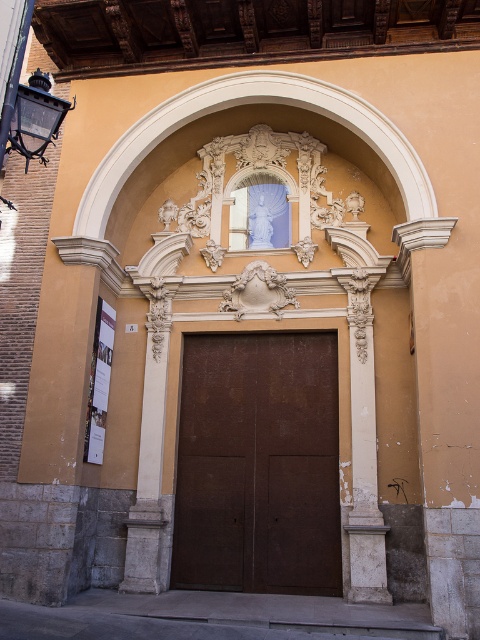
Question: Is the position of brown matte door at center more distant than that of white stone column at left?

Choices:
 (A) no
 (B) yes

Answer: (A)

Question: Among these objects, which one is farthest from the camera?

Choices:
 (A) brown matte door at center
 (B) white stone column at left

Answer: (B)

Question: Can you confirm if brown matte door at center is positioned above white stone column at left?

Choices:
 (A) no
 (B) yes

Answer: (A)

Question: In this image, where is brown matte door at center located relative to white stone column at left?

Choices:
 (A) right
 (B) left

Answer: (A)

Question: Among these objects, which one is farthest from the camera?

Choices:
 (A) brown matte door at center
 (B) white stone column at left

Answer: (B)